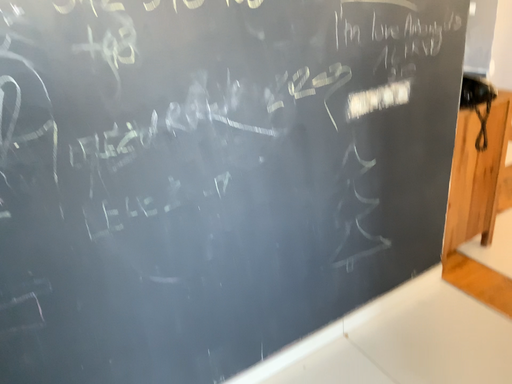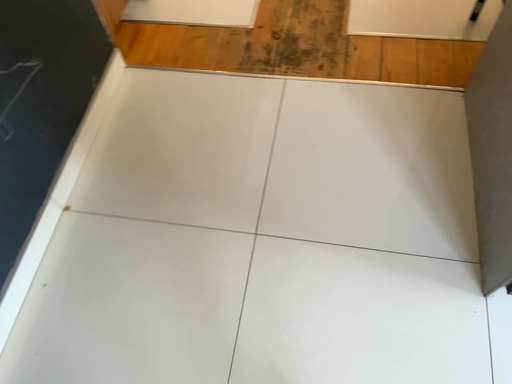
Question: How did the camera likely rotate when shooting the video?

Choices:
 (A) rotated upward
 (B) rotated downward

Answer: (B)